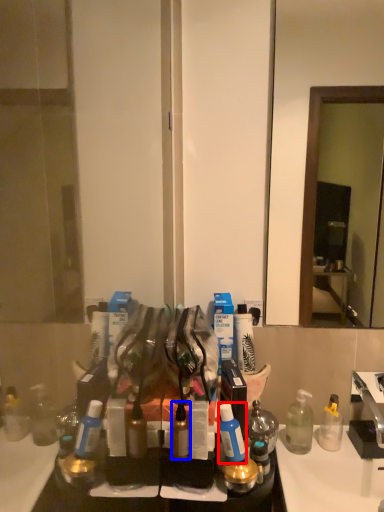
Question: Which object is further to the camera taking this photo, toiletry (highlighted by a red box) or toiletry (highlighted by a blue box)?

Choices:
 (A) toiletry
 (B) toiletry

Answer: (B)